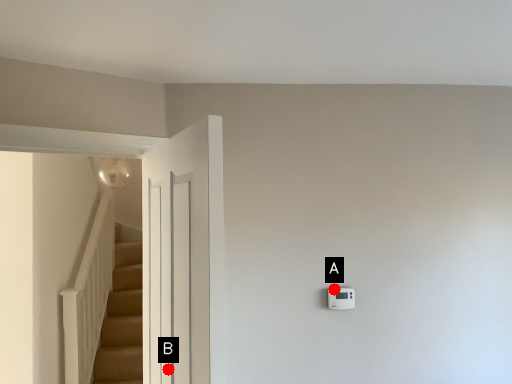
Question: Two points are circled on the image, labeled by A and B beside each circle. Which point is closer to the camera?

Choices:
 (A) A is closer
 (B) B is closer

Answer: (B)